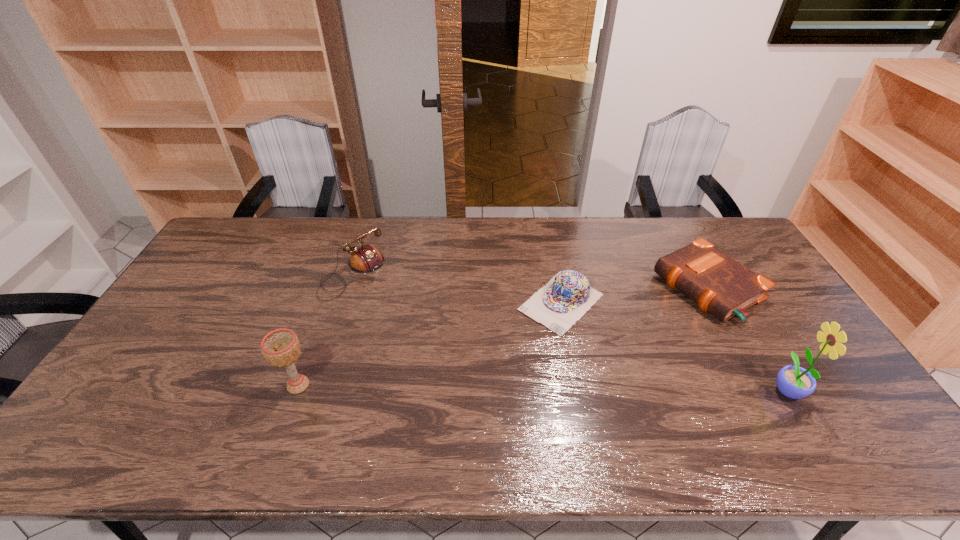
Find the location of `chalice`. chalice is located at coordinates (281, 347).

Identify the location of sunflower. This screenshot has height=540, width=960. (795, 382).

Where is `Bible`? The height and width of the screenshot is (540, 960). Bible is located at coordinates (720, 285).

Identify the location of telephone. (365, 259).

This screenshot has height=540, width=960. What are the coordinates of `the third object from right to left` in the screenshot? It's located at (568, 296).

At what (x,y) coordinates should I click in order to perform the action: click on free space located 0.360m on the back of the fourth shortest object. Please return your answer as a coordinate pair (x, y). The image size is (960, 540). Looking at the image, I should click on (336, 281).

At what (x,y) coordinates should I click in order to perform the action: click on free space located on the front-facing side of the tallest object. Please return your answer as a coordinate pair (x, y). This screenshot has width=960, height=540. Looking at the image, I should click on (x=845, y=389).

At what (x,y) coordinates should I click in order to perform the action: click on vacant space situated 0.170m on the spine side of the Bible. Please return your answer as a coordinate pair (x, y). The width and height of the screenshot is (960, 540). Looking at the image, I should click on (633, 328).

Where is `free space located on the spine side of the Bible`? free space located on the spine side of the Bible is located at coordinates (601, 345).

At what (x,y) coordinates should I click in order to perform the action: click on vacant position located 0.350m on the spine side of the Bible. Please return your answer as a coordinate pair (x, y). The width and height of the screenshot is (960, 540). Looking at the image, I should click on (585, 354).